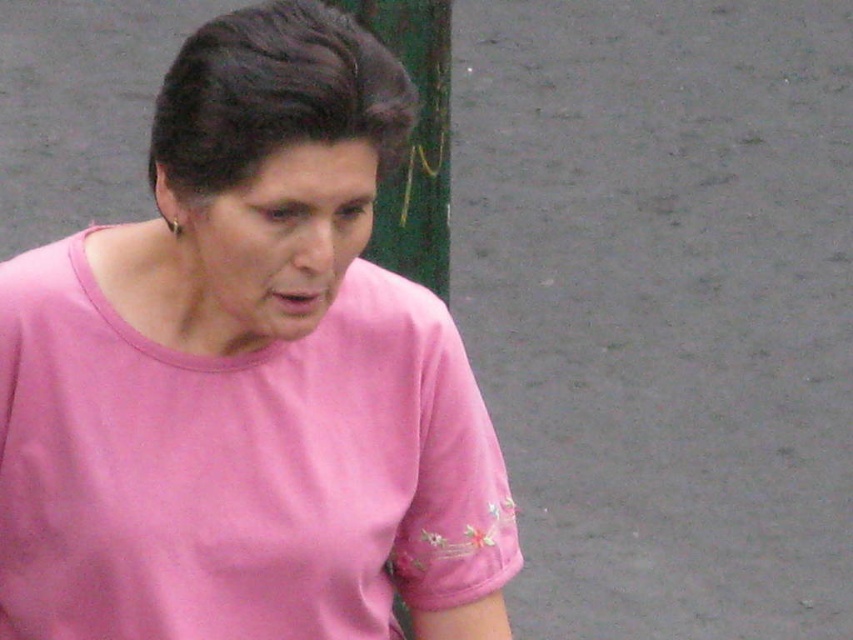
How much distance is there between pink fabric shirt at center and green painted wood pole at upper center?

They are 34.79 inches apart.

Who is lower down, pink fabric shirt at center or green painted wood pole at upper center?

Positioned lower is pink fabric shirt at center.

Who is more forward, (241, 406) or (442, 54)?

Point (241, 406) is more forward.

Locate an element on the screen. The width and height of the screenshot is (853, 640). pink fabric shirt at center is located at coordinates (247, 378).